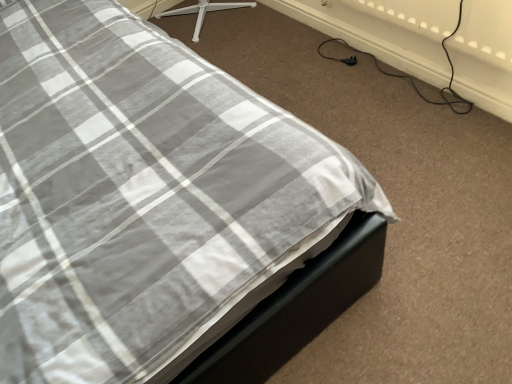
What do you see at coordinates (411, 77) in the screenshot? I see `black rubber cable at lower right` at bounding box center [411, 77].

Locate an element on the screen. This screenshot has width=512, height=384. black rubber cable at lower right is located at coordinates (411, 77).

Measure the distance between black rubber cable at lower right and camera.

black rubber cable at lower right and camera are 1.38 meters apart from each other.

The image size is (512, 384). Describe the element at coordinates (350, 61) in the screenshot. I see `black plastic plug at lower right` at that location.

Where is `black plastic plug at lower right`? black plastic plug at lower right is located at coordinates (350, 61).

This screenshot has height=384, width=512. I want to click on black rubber cable at lower right, so click(411, 77).

Between black rubber cable at lower right and black plastic plug at lower right, which one appears on the left side from the viewer's perspective?

black plastic plug at lower right is more to the left.

From the picture: Considering their positions, is black rubber cable at lower right located in front of or behind black plastic plug at lower right?

In the image, black rubber cable at lower right appears in front of black plastic plug at lower right.

Is point (447, 88) positioned behind point (351, 64)?

No.

From the image's perspective, which one is positioned lower, black rubber cable at lower right or black plastic plug at lower right?

black plastic plug at lower right.

From the picture: From a real-world perspective, is black rubber cable at lower right positioned under black plastic plug at lower right based on gravity?

No.

In terms of width, does black rubber cable at lower right look wider or thinner when compared to black plastic plug at lower right?

In the image, black rubber cable at lower right appears to be wider than black plastic plug at lower right.

Can you confirm if black rubber cable at lower right is taller than black plastic plug at lower right?

Indeed, black rubber cable at lower right has a greater height compared to black plastic plug at lower right.

Is black rubber cable at lower right bigger than black plastic plug at lower right?

Correct, black rubber cable at lower right is larger in size than black plastic plug at lower right.

Would you say black plastic plug at lower right is part of black rubber cable at lower right's contents?

No, black rubber cable at lower right does not contain black plastic plug at lower right.

Is black rubber cable at lower right placed right next to black plastic plug at lower right?

There is a gap between black rubber cable at lower right and black plastic plug at lower right.

Is black rubber cable at lower right facing away from black plastic plug at lower right?

black rubber cable at lower right does not have its back to black plastic plug at lower right.

What's the angular difference between black rubber cable at lower right and black plastic plug at lower right's facing directions?

6.4 degrees.

The image size is (512, 384). I want to click on cable located on the right of black plastic plug at lower right, so click(411, 77).

Which is more to the left, black plastic plug at lower right or black rubber cable at lower right?

black plastic plug at lower right.

Is black plastic plug at lower right behind black rubber cable at lower right?

That is True.

Which is in front, point (353, 59) or point (352, 50)?

Point (353, 59)

From the image's perspective, is black plastic plug at lower right over black rubber cable at lower right?

No.

From a real-world perspective, between black plastic plug at lower right and black rubber cable at lower right, who is vertically higher?

From a 3D spatial view, black rubber cable at lower right is above.

Is black plastic plug at lower right wider than black rubber cable at lower right?

Incorrect, the width of black plastic plug at lower right does not surpass that of black rubber cable at lower right.

Does black plastic plug at lower right have a lesser height compared to black rubber cable at lower right?

Indeed, black plastic plug at lower right has a lesser height compared to black rubber cable at lower right.

Who is smaller, black plastic plug at lower right or black rubber cable at lower right?

black plastic plug at lower right is smaller.

Is black plastic plug at lower right positioned beyond the bounds of black rubber cable at lower right?

That's correct, black plastic plug at lower right is outside of black rubber cable at lower right.

Is black plastic plug at lower right far from black rubber cable at lower right?

No, black plastic plug at lower right is not far from black rubber cable at lower right.

Is black plastic plug at lower right turned away from black rubber cable at lower right?

No, black plastic plug at lower right's orientation is not away from black rubber cable at lower right.

In order to click on plug behind the black rubber cable at lower right in this screenshot , I will do `click(350, 61)`.

In the image, there is a black plastic plug at lower right. Identify the location of cable above it (from the image's perspective). (411, 77).

Find the location of `cable that is on the right side of black plastic plug at lower right`. cable that is on the right side of black plastic plug at lower right is located at coordinates (411, 77).